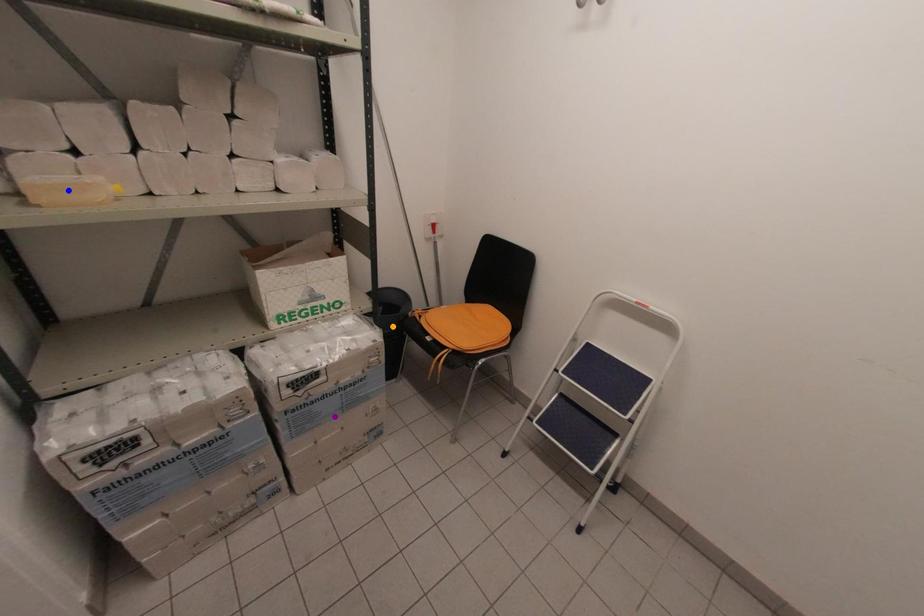
Looking at this image, order these from nearest to farthest:
purple point, blue point, orange point

1. blue point
2. purple point
3. orange point